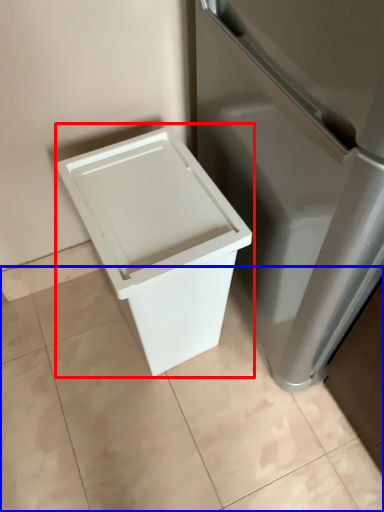
Question: Which point is further to the camera, waste container (highlighted by a red box) or tile (highlighted by a blue box)?

Choices:
 (A) waste container
 (B) tile

Answer: (B)